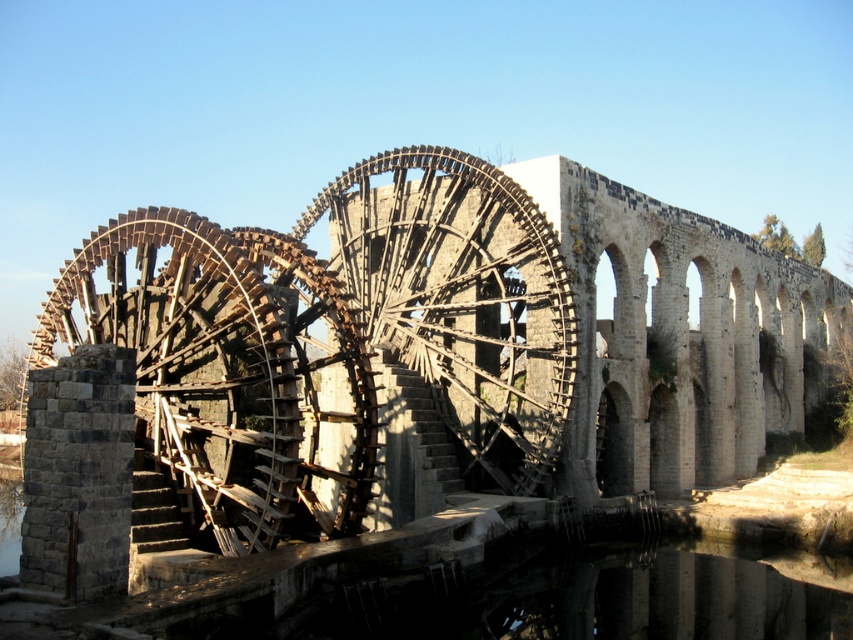
Question: Does wooden waterwheel at left appear on the right side of wooden spokes at center?

Choices:
 (A) yes
 (B) no

Answer: (B)

Question: Can you confirm if wooden waterwheel at left is wider than wooden spokes at center?

Choices:
 (A) no
 (B) yes

Answer: (A)

Question: Which point is closer to the camera?

Choices:
 (A) wooden spokes at center
 (B) wooden waterwheel at left

Answer: (B)

Question: Which point is closer to the camera?

Choices:
 (A) (548, 276)
 (B) (262, 332)

Answer: (B)

Question: Does wooden waterwheel at left appear on the left side of wooden spokes at center?

Choices:
 (A) no
 (B) yes

Answer: (B)

Question: Among these objects, which one is nearest to the camera?

Choices:
 (A) wooden spokes at center
 (B) wooden waterwheel at left

Answer: (B)